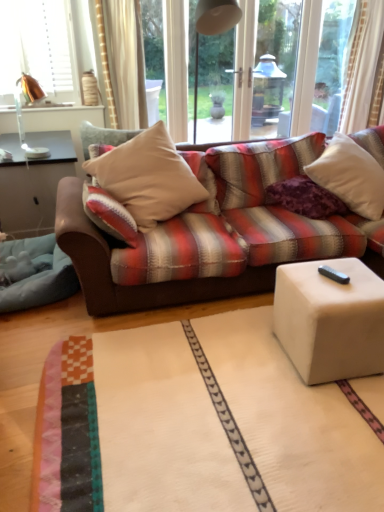
What do you see at coordinates (21, 112) in the screenshot?
I see `copper metallic table lamp at upper left` at bounding box center [21, 112].

This screenshot has width=384, height=512. Find the location of `black plastic remote control at lower right`. black plastic remote control at lower right is located at coordinates (333, 274).

Identify the location of blue soft fabric at lower left. This screenshot has height=512, width=384. [35, 274].

Relative to white matte cube at lower right, is purple velvet pillow at center, the 2th pillow from the right, in front or behind?

purple velvet pillow at center, the 2th pillow from the right, is positioned farther from the viewer than white matte cube at lower right.

I want to click on table that appears below the purple velvet pillow at center, marked as the second pillow in a left-to-right arrangement (from a real-world perspective), so click(330, 320).

Based on the photo, is purple velvet pillow at center, marked as the second pillow in a left-to-right arrangement, thinner than white matte cube at lower right?

No.

From the image's perspective, which one is positioned higher, purple velvet pillow at center, the 2th pillow from the right, or black plastic remote control at lower right?

purple velvet pillow at center, the 2th pillow from the right, from the image's perspective.

Which object is closer to the camera, purple velvet pillow at center, the 2th pillow from the right, or black plastic remote control at lower right?

black plastic remote control at lower right is more forward.

Is purple velvet pillow at center, marked as the second pillow in a left-to-right arrangement, shorter than black plastic remote control at lower right?

No, purple velvet pillow at center, marked as the second pillow in a left-to-right arrangement, is not shorter than black plastic remote control at lower right.

Is black plastic remote control at lower right a part of purple velvet pillow at center, the 2th pillow from the right?

No.

Which object is thinner, blue soft fabric at lower left or black plastic remote control at lower right?

Thinner between the two is black plastic remote control at lower right.

Which is correct: blue soft fabric at lower left is inside black plastic remote control at lower right, or outside of it?

blue soft fabric at lower left is not enclosed by black plastic remote control at lower right.

From a real-world perspective, is blue soft fabric at lower left below black plastic remote control at lower right?

Correct, in the physical world, blue soft fabric at lower left is lower than black plastic remote control at lower right.

Is blue soft fabric at lower left oriented away from black plastic remote control at lower right?

No, blue soft fabric at lower left is not facing away from black plastic remote control at lower right.

Consider the image. Considering their positions, is blue soft fabric at lower left located in front of or behind purple velvet pillow at center, the 2th pillow from the right?

In the image, blue soft fabric at lower left appears in front of purple velvet pillow at center, the 2th pillow from the right.

Can you see blue soft fabric at lower left touching purple velvet pillow at center, the 2th pillow from the right?

There is a gap between blue soft fabric at lower left and purple velvet pillow at center, the 2th pillow from the right.

From the image's perspective, is blue soft fabric at lower left on purple velvet pillow at center, the 2th pillow from the right?

No, from the image's perspective, blue soft fabric at lower left is not on top of purple velvet pillow at center, the 2th pillow from the right.

Is blue soft fabric at lower left situated inside purple velvet pillow at center, marked as the second pillow in a left-to-right arrangement, or outside?

blue soft fabric at lower left lies outside purple velvet pillow at center, marked as the second pillow in a left-to-right arrangement.

Considering the positions of objects blue soft fabric at lower left and copper metallic table lamp at upper left in the image provided, who is more to the right, blue soft fabric at lower left or copper metallic table lamp at upper left?

blue soft fabric at lower left is more to the right.

Would you say blue soft fabric at lower left is inside or outside copper metallic table lamp at upper left?

blue soft fabric at lower left exists outside the volume of copper metallic table lamp at upper left.

Does blue soft fabric at lower left have a larger size compared to copper metallic table lamp at upper left?

Yes.

Between blue soft fabric at lower left and beige fabric pillow at center, the 1th pillow viewed from the left, which one has smaller width?

With smaller width is beige fabric pillow at center, the 1th pillow viewed from the left.

From a real-world perspective, which object stands above the other?

beige fabric pillow at center, which is the 3th pillow from right to left, from a real-world perspective.

Consider the image. Is blue soft fabric at lower left outside of beige fabric pillow at center, which is the 3th pillow from right to left?

blue soft fabric at lower left lies outside beige fabric pillow at center, which is the 3th pillow from right to left,'s area.

Considering the relative sizes of blue soft fabric at lower left and beige fabric pillow at center, the 1th pillow viewed from the left, in the image provided, is blue soft fabric at lower left taller than beige fabric pillow at center, the 1th pillow viewed from the left,?

No.

In terms of size, does white soft cushion at upper right, the 3th pillow positioned from the left, appear bigger or smaller than blue soft fabric at lower left?

In the image, white soft cushion at upper right, the 3th pillow positioned from the left, appears to be larger than blue soft fabric at lower left.

Considering the positions of objects white soft cushion at upper right, arranged as the first pillow when viewed from the right, and blue soft fabric at lower left in the image provided, who is more to the right, white soft cushion at upper right, arranged as the first pillow when viewed from the right, or blue soft fabric at lower left?

Positioned to the right is white soft cushion at upper right, arranged as the first pillow when viewed from the right.

Considering the sizes of objects white soft cushion at upper right, arranged as the first pillow when viewed from the right, and blue soft fabric at lower left in the image provided, who is shorter, white soft cushion at upper right, arranged as the first pillow when viewed from the right, or blue soft fabric at lower left?

blue soft fabric at lower left is shorter.

Is the surface of white soft cushion at upper right, the 3th pillow positioned from the left, in direct contact with blue soft fabric at lower left?

No, white soft cushion at upper right, the 3th pillow positioned from the left, is not making contact with blue soft fabric at lower left.

I want to click on pillow that is the 1st object located above the white matte cube at lower right (from the image's perspective), so click(x=305, y=198).

Find the location of a particular element. This screenshot has width=384, height=512. remote control located underneath the purple velvet pillow at center, marked as the second pillow in a left-to-right arrangement (from a real-world perspective) is located at coordinates (333, 274).

Estimate the real-world distances between objects in this image. Which object is further from beige fabric pillow at center, which is the 3th pillow from right to left, blue soft fabric at lower left or black plastic remote control at lower right?

black plastic remote control at lower right is further to beige fabric pillow at center, which is the 3th pillow from right to left.

Considering their positions, is blue soft fabric at lower left positioned further to copper metallic table lamp at upper left than white matte cube at lower right?

white matte cube at lower right lies further to copper metallic table lamp at upper left than the other object.

When comparing their distances from black plastic remote control at lower right, does white soft cushion at upper right, arranged as the first pillow when viewed from the right, or purple velvet pillow at center, marked as the second pillow in a left-to-right arrangement, seem closer?

Based on the image, purple velvet pillow at center, marked as the second pillow in a left-to-right arrangement, appears to be nearer to black plastic remote control at lower right.

Considering their positions, is beige fabric pillow at center, the 1th pillow viewed from the left, positioned closer to purple velvet pillow at center, marked as the second pillow in a left-to-right arrangement, than copper metallic table lamp at upper left?

Based on the image, beige fabric pillow at center, the 1th pillow viewed from the left, appears to be nearer to purple velvet pillow at center, marked as the second pillow in a left-to-right arrangement.

Estimate the real-world distances between objects in this image. Which object is closer to black plastic remote control at lower right, copper metallic table lamp at upper left or blue soft fabric at lower left?

Based on the image, blue soft fabric at lower left appears to be nearer to black plastic remote control at lower right.

Considering their positions, is white matte cube at lower right positioned closer to beige fabric pillow at center, which is the 3th pillow from right to left, than white soft cushion at upper right, arranged as the first pillow when viewed from the right?

Among the two, white soft cushion at upper right, arranged as the first pillow when viewed from the right, is located nearer to beige fabric pillow at center, which is the 3th pillow from right to left.

Which object lies nearer to the anchor point copper metallic table lamp at upper left, beige fabric pillow at center, which is the 3th pillow from right to left, or blue soft fabric at lower left?

Based on the image, beige fabric pillow at center, which is the 3th pillow from right to left, appears to be nearer to copper metallic table lamp at upper left.

Which object lies further to the anchor point black plastic remote control at lower right, purple velvet pillow at center, marked as the second pillow in a left-to-right arrangement, or white matte cube at lower right?

Among the two, purple velvet pillow at center, marked as the second pillow in a left-to-right arrangement, is located further to black plastic remote control at lower right.

Locate an element on the screen. The image size is (384, 512). remote control located between white matte cube at lower right and purple velvet pillow at center, marked as the second pillow in a left-to-right arrangement, in the depth direction is located at coordinates (333, 274).

Locate an element on the screen. This screenshot has width=384, height=512. blanket between copper metallic table lamp at upper left and black plastic remote control at lower right in the horizontal direction is located at coordinates (35, 274).

Where is `blanket between copper metallic table lamp at upper left and white soft cushion at upper right, the 3th pillow positioned from the left, in the horizontal direction`? The width and height of the screenshot is (384, 512). blanket between copper metallic table lamp at upper left and white soft cushion at upper right, the 3th pillow positioned from the left, in the horizontal direction is located at coordinates (35, 274).

Find the location of a particular element. remote control located between beige fabric pillow at center, the 1th pillow viewed from the left, and white matte cube at lower right in the left-right direction is located at coordinates (333, 274).